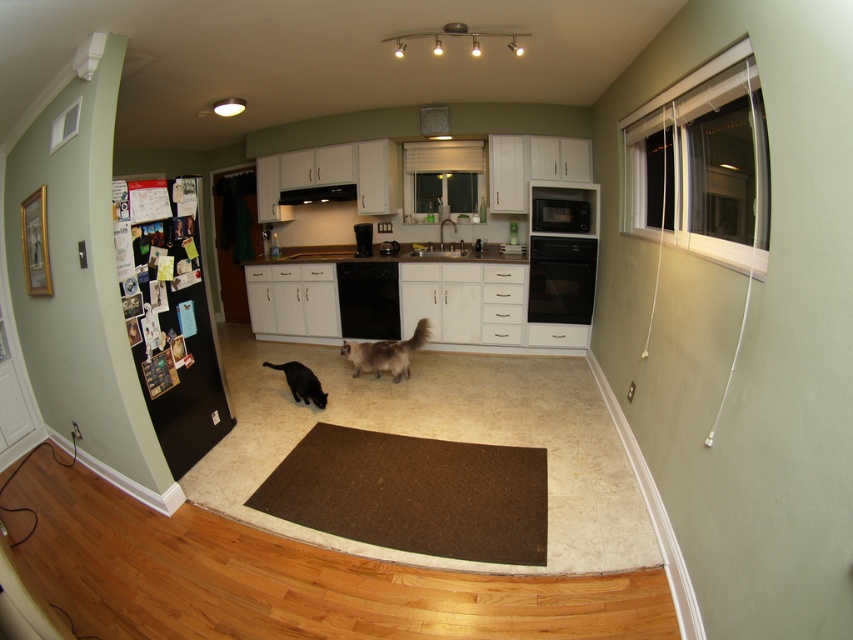
You are a home inspector examining the kitchen layout. You notice two dishwashers labeled black glossy dishwasher at center and black matte dishwasher at center. Which one is placed lower in the kitchen?

The black glossy dishwasher at center is positioned under the black matte dishwasher at center, so it is placed lower in the kitchen.

You are a photographer trying to capture both the fuzzy white cat at center and the black fur cat at center in a single shot. Which cat will appear larger in the photo due to their size difference?

The fuzzy white cat at center will appear larger in the photo because it is much taller than the black fur cat at center.